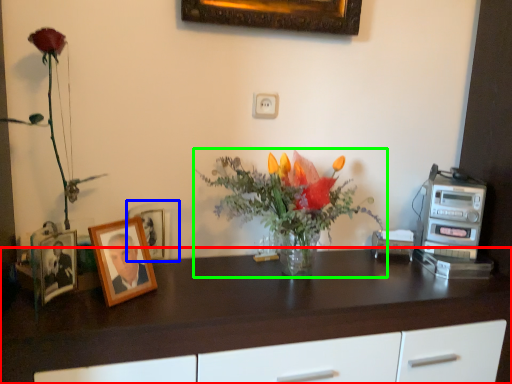
Question: Considering the real-world distances, which object is closest to desk (highlighted by a red box)? picture frame (highlighted by a blue box) or houseplant (highlighted by a green box).

Choices:
 (A) picture frame
 (B) houseplant

Answer: (B)